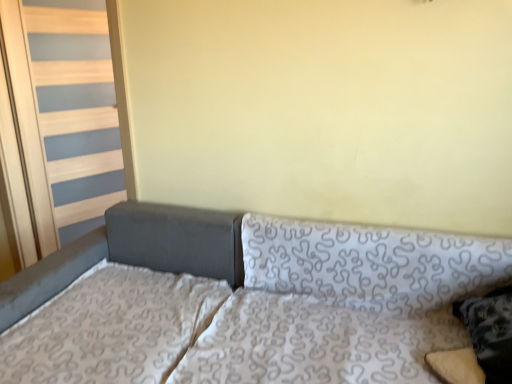
Locate an element on the screen. The image size is (512, 384). vacant space situated above patterned fabric mattress at lower left (from a real-world perspective) is located at coordinates (105, 319).